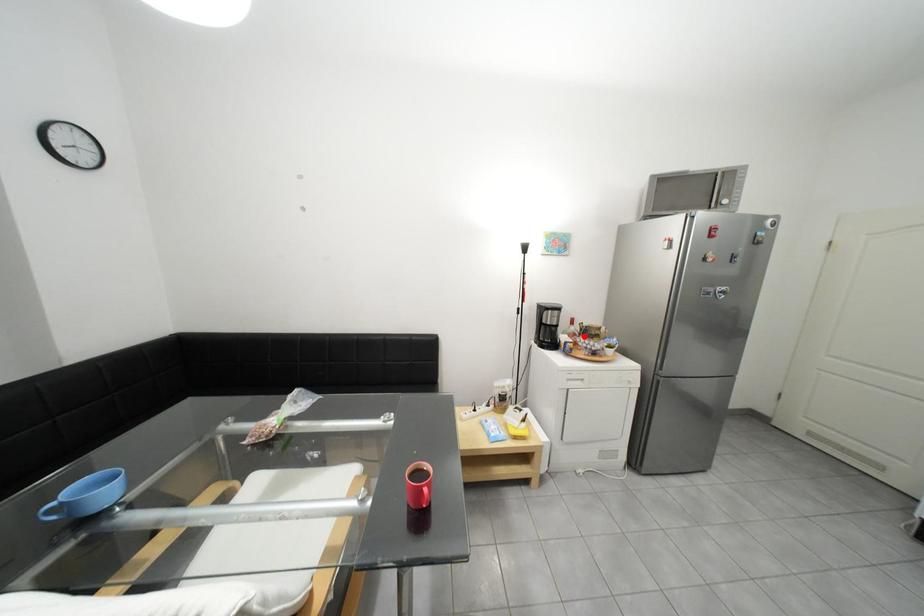
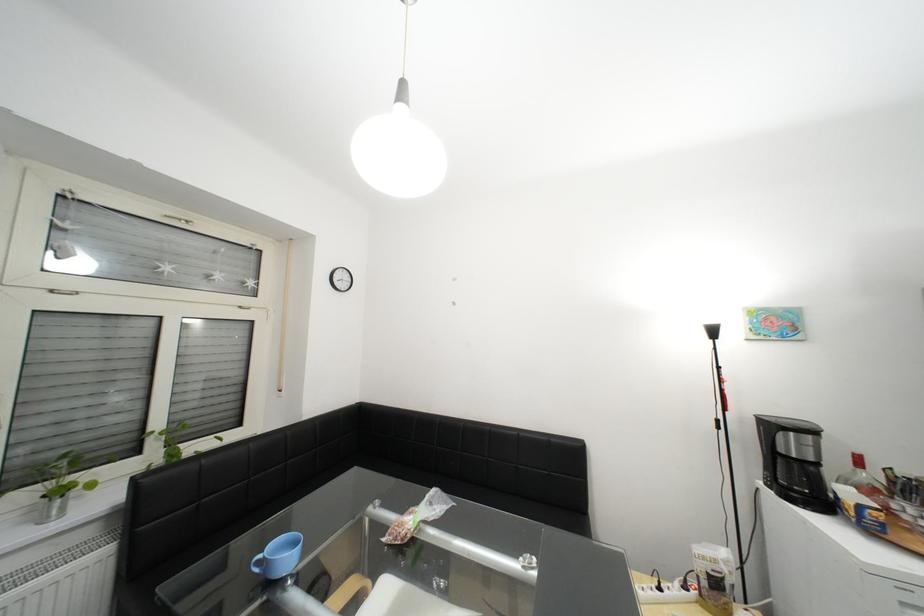
Question: I am providing you with two images of the same scene from different viewpoints. In image1, a red point is highlighted. Considering the same 3D point in image2, which of the following is correct?

Choices:
 (A) It is closer
 (B) It is farther

Answer: (A)